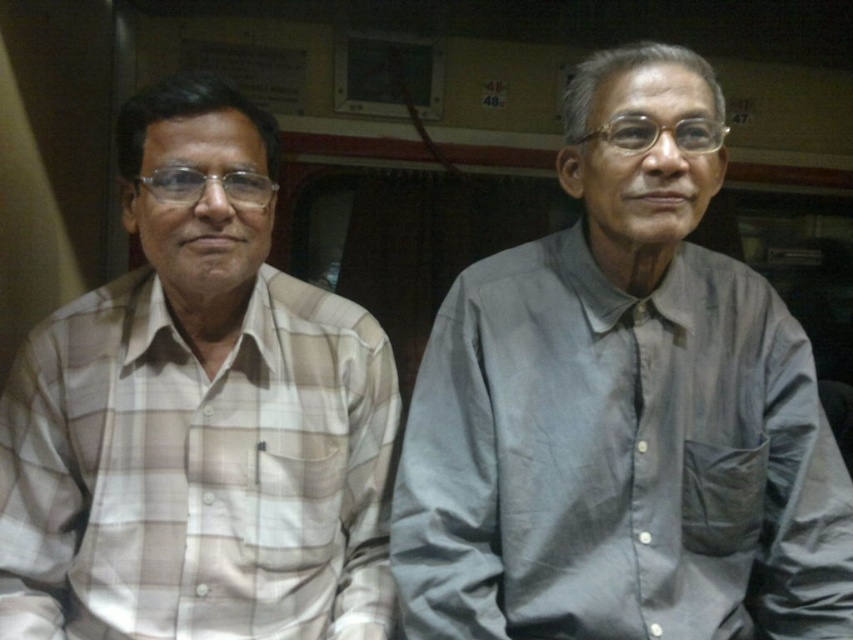
Who is more distant from viewer, [811,492] or [270,378]?

The point [270,378] is behind.

Between gray cotton shirt at right and light beige plaid shirt at left, which one appears on the right side from the viewer's perspective?

From the viewer's perspective, gray cotton shirt at right appears more on the right side.

At what (x,y) coordinates should I click in order to perform the action: click on gray cotton shirt at right. Please return your answer as a coordinate pair (x, y). The width and height of the screenshot is (853, 640). Looking at the image, I should click on (622, 410).

Identify the location of gray cotton shirt at right. (622, 410).